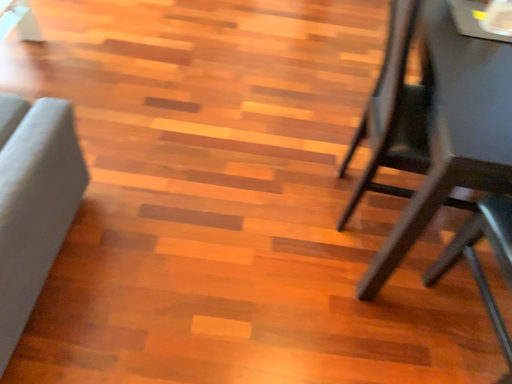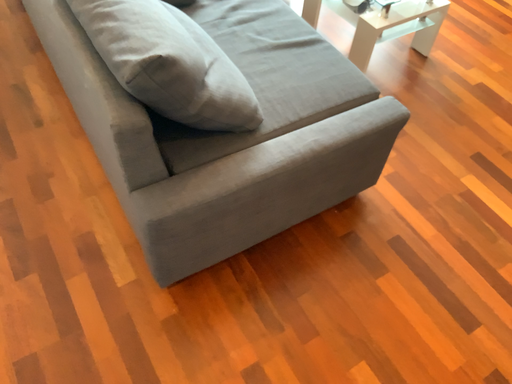
Question: Which way did the camera rotate in the video?

Choices:
 (A) rotated downward
 (B) rotated upward

Answer: (B)